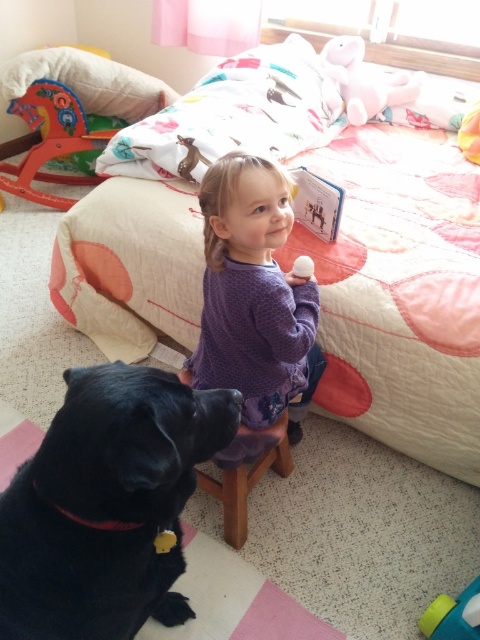
Is black shiny dog at lower left wider than wooden stool at lower center?

Yes.

Can you confirm if black shiny dog at lower left is positioned to the left of wooden stool at lower center?

Indeed, black shiny dog at lower left is positioned on the left side of wooden stool at lower center.

Does point (19, 628) lie in front of point (236, 515)?

Yes.

The height and width of the screenshot is (640, 480). In order to click on black shiny dog at lower left in this screenshot , I will do `click(107, 504)`.

Which is more to the right, floral quilted bed at center or pink plush bear at upper center?

From the viewer's perspective, pink plush bear at upper center appears more on the right side.

Is floral quilted bed at center wider than pink plush bear at upper center?

Yes, floral quilted bed at center is wider than pink plush bear at upper center.

Locate an element on the screen. floral quilted bed at center is located at coordinates (301, 253).

Can you confirm if floral quilted bed at center is bigger than purple dotted sweater at center?

Yes, floral quilted bed at center is bigger than purple dotted sweater at center.

Which is in front, point (203, 156) or point (219, 276)?

Point (219, 276) is in front.

Describe the element at coordinates (301, 253) in the screenshot. The image size is (480, 640). I see `floral quilted bed at center` at that location.

This screenshot has height=640, width=480. Identify the location of floral quilted bed at center. (301, 253).